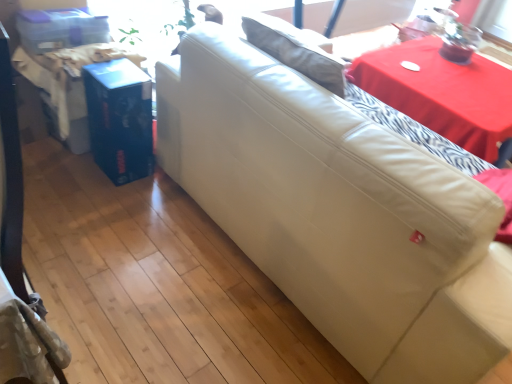
Question: Would you say red fabric table at upper right is to the left or to the right of leather couch at center in the picture?

Choices:
 (A) right
 (B) left

Answer: (A)

Question: Considering the positions of red fabric table at upper right and leather couch at center in the image, is red fabric table at upper right bigger or smaller than leather couch at center?

Choices:
 (A) big
 (B) small

Answer: (B)

Question: Relative to leather couch at center, is red fabric table at upper right in front or behind?

Choices:
 (A) front
 (B) behind

Answer: (B)

Question: Considering the positions of point (410, 291) and point (420, 59), is point (410, 291) closer or farther from the camera than point (420, 59)?

Choices:
 (A) farther
 (B) closer

Answer: (B)

Question: Based on their sizes in the image, would you say leather couch at center is bigger or smaller than red fabric table at upper right?

Choices:
 (A) small
 (B) big

Answer: (B)

Question: In terms of height, does leather couch at center look taller or shorter compared to red fabric table at upper right?

Choices:
 (A) short
 (B) tall

Answer: (B)

Question: From the image's perspective, relative to red fabric table at upper right, is leather couch at center above or below?

Choices:
 (A) below
 (B) above

Answer: (A)